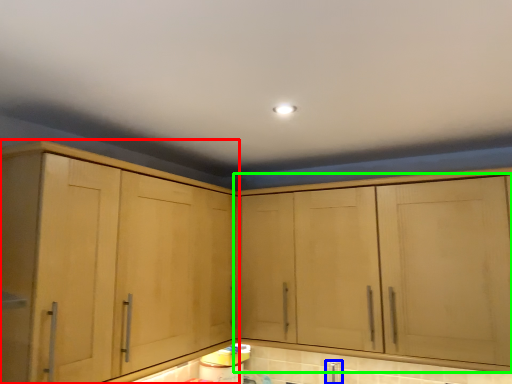
Question: Which is farther away from cabinetry (highlighted by a red box)? faucet (highlighted by a blue box) or cabinetry (highlighted by a green box)?

Choices:
 (A) faucet
 (B) cabinetry

Answer: (A)